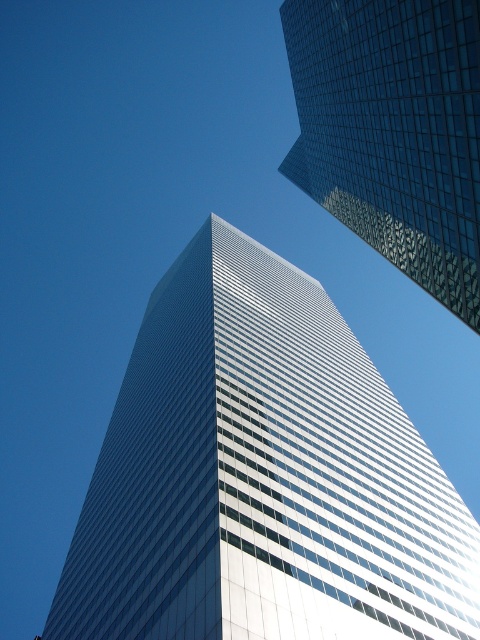
You are standing at the center of the image and want to take a photo of the glassy reflective skyscraper at center. Based on its position, in which direction should you aim your camera?

The glassy reflective skyscraper at center is located at point [262,476], so you should aim your camera towards the right and slightly downward to capture it.